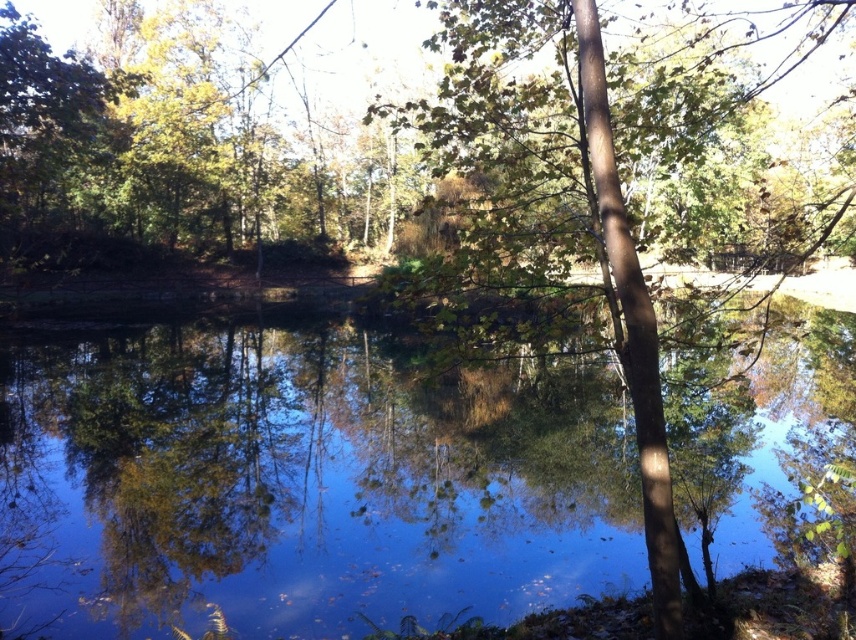
Question: Which object appears farthest from the camera in this image?

Choices:
 (A) green matte tree at center
 (B) transparent water at center

Answer: (B)

Question: Which object is the closest to the transparent water at center?

Choices:
 (A) green leafy tree at center
 (B) green matte tree at center

Answer: (B)

Question: Can you confirm if green matte tree at center is smaller than green leafy tree at center?

Choices:
 (A) no
 (B) yes

Answer: (B)

Question: Which of the following is the closest to the observer?

Choices:
 (A) green leafy tree at center
 (B) green matte tree at center
 (C) transparent water at center

Answer: (B)

Question: Is transparent water at center positioned at the back of green matte tree at center?

Choices:
 (A) yes
 (B) no

Answer: (A)

Question: Observing the image, what is the correct spatial positioning of green matte tree at center in reference to green leafy tree at center?

Choices:
 (A) above
 (B) below

Answer: (B)